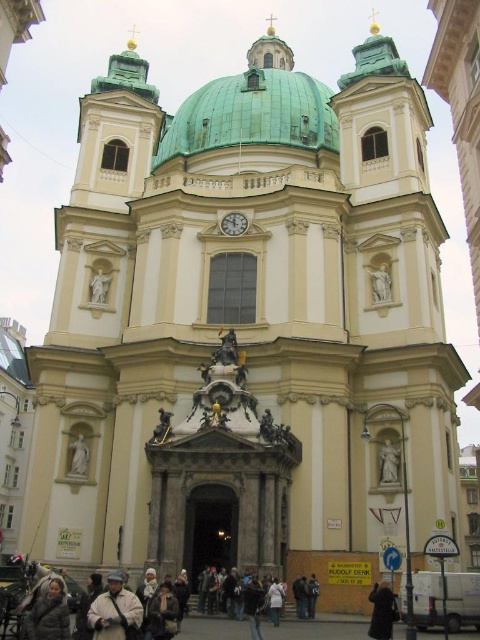
Does light brown leather jacket at lower center have a lesser width compared to black leather coat at lower center?

No, light brown leather jacket at lower center is not thinner than black leather coat at lower center.

Is point (137, 609) in front of point (384, 592)?

Yes, point (137, 609) is in front of point (384, 592).

This screenshot has height=640, width=480. Identify the location of light brown leather jacket at lower center. (115, 611).

Is white marble statue at lower right behind white marble statue at upper right?

No, it is not.

How much distance is there between white marble statue at lower right and white marble statue at upper right?

white marble statue at lower right and white marble statue at upper right are 52.25 feet apart.

Which is in front, point (394, 461) or point (383, 298)?

Positioned in front is point (394, 461).

The height and width of the screenshot is (640, 480). In order to click on white marble statue at lower right in this screenshot , I will do tap(388, 461).

Is white marble statue at upper right smaller than white marble statue at upper left?

Actually, white marble statue at upper right might be larger than white marble statue at upper left.

Locate an element on the screen. white marble statue at upper right is located at coordinates (381, 282).